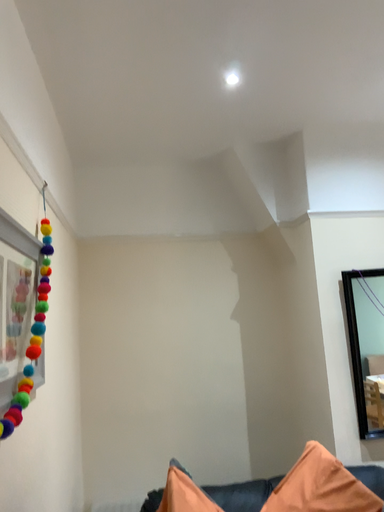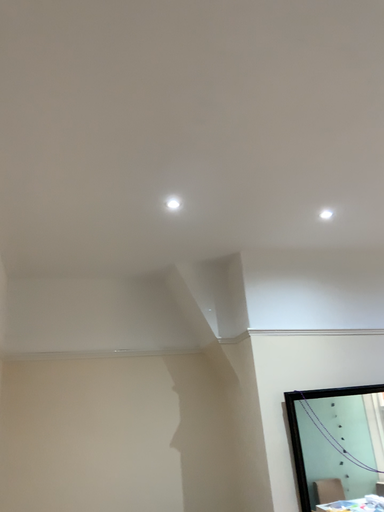
Question: Which way did the camera rotate in the video?

Choices:
 (A) rotated downward
 (B) rotated upward

Answer: (B)